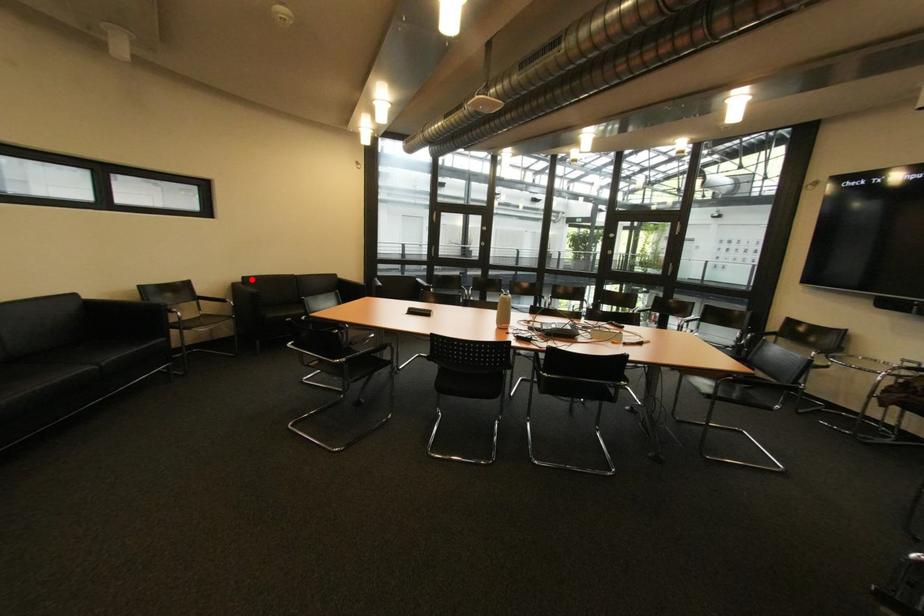
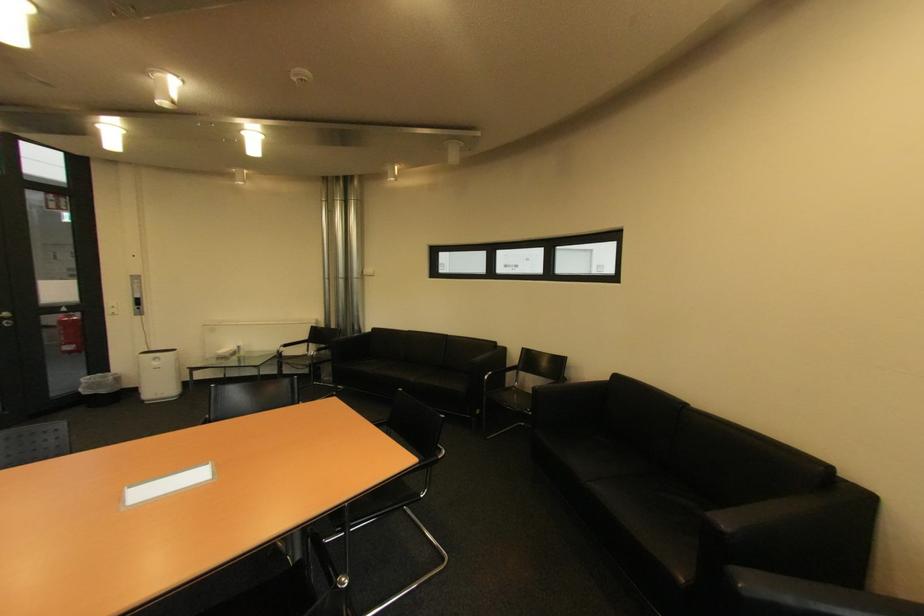
Find the pixel in the second image that matches the highlighted location in the first image.

(625, 378)